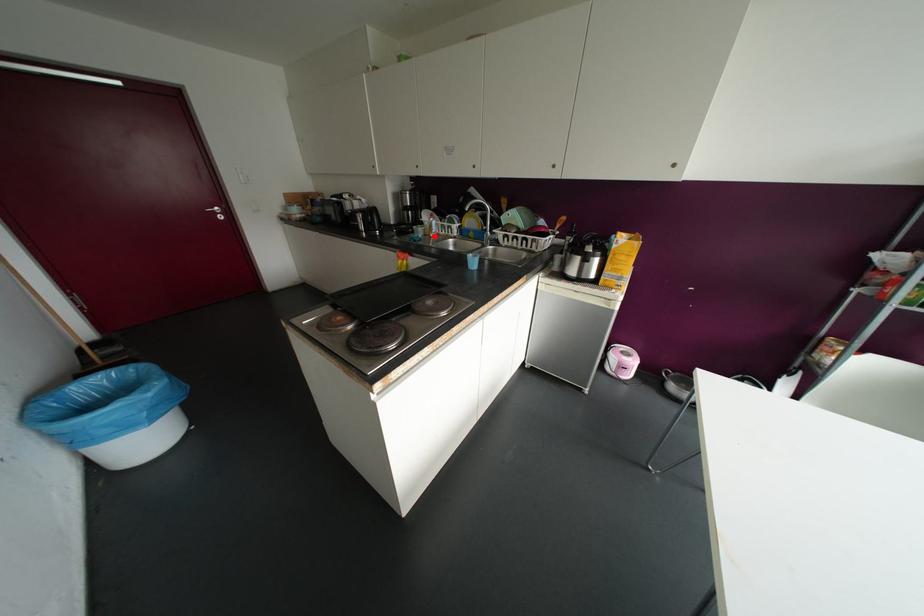
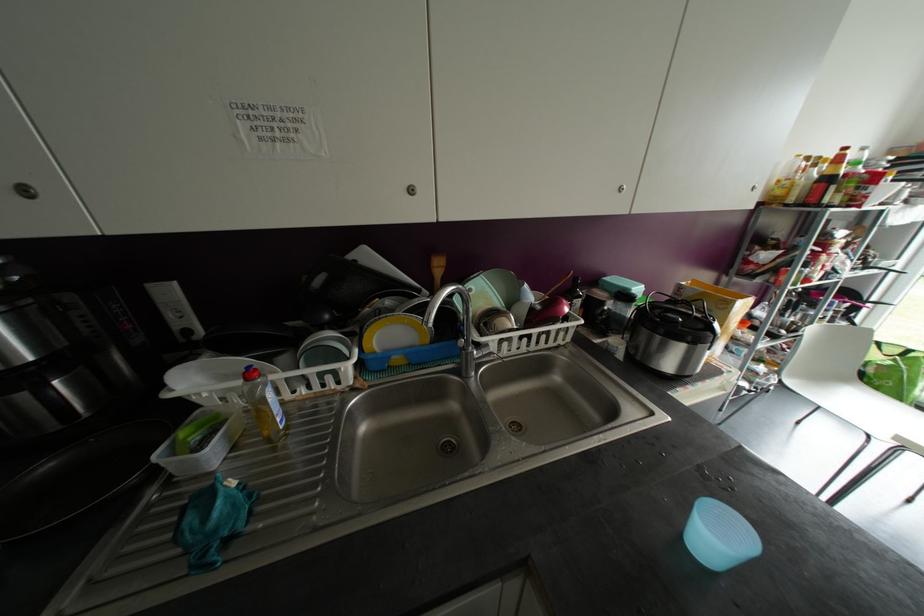
The point at the highlighted location is marked in the first image. Where is the corresponding point in the second image?

(286, 427)